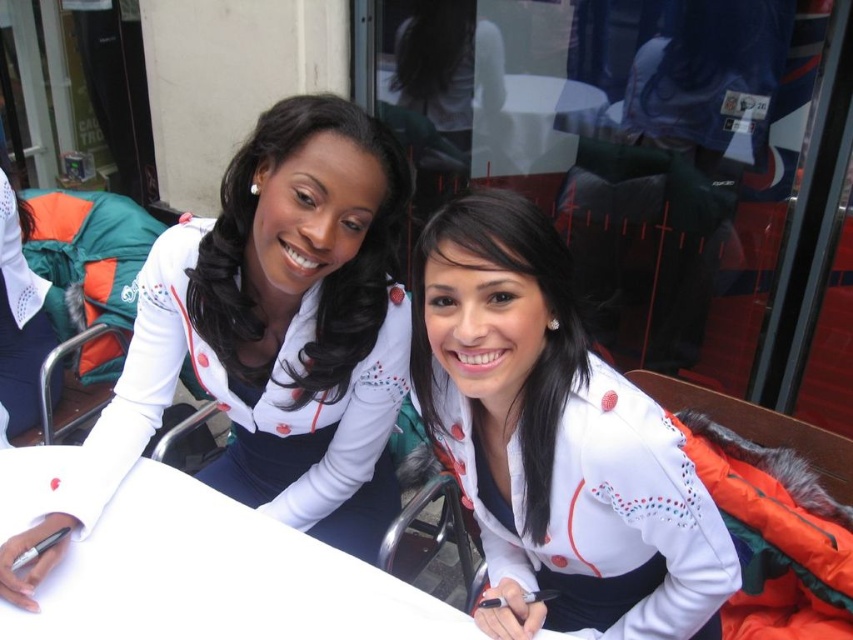
Who is lower down, white matte jacket at upper left or white matte jacket at center?

Positioned lower is white matte jacket at center.

Between white matte jacket at upper left and white matte jacket at center, which one has more height?

white matte jacket at upper left

The width and height of the screenshot is (853, 640). I want to click on white matte jacket at upper left, so click(270, 337).

The height and width of the screenshot is (640, 853). I want to click on white matte jacket at upper left, so click(x=270, y=337).

Between point (247, 273) and point (202, 616), which one is positioned behind?

The point (247, 273) is more distant.

Is white matte jacket at upper left taller than white paper at center?

Indeed, white matte jacket at upper left has a greater height compared to white paper at center.

Which is behind, point (9, 550) or point (152, 499)?

Point (152, 499)

The width and height of the screenshot is (853, 640). In order to click on white matte jacket at upper left in this screenshot , I will do `click(270, 337)`.

Does white matte jacket at center have a greater height compared to white paper at center?

Yes, white matte jacket at center is taller than white paper at center.

Does white matte jacket at center come in front of white paper at center?

Yes, it is.

Which is behind, point (697, 604) or point (146, 502)?

The point (146, 502) is more distant.

You are a GUI agent. You are given a task and a screenshot of the screen. Output one action in this format:
    pyautogui.click(x=<x>, y=<y>)
    Task: Click on the white matte jacket at center
    
    Given the screenshot: What is the action you would take?
    pyautogui.click(x=555, y=442)